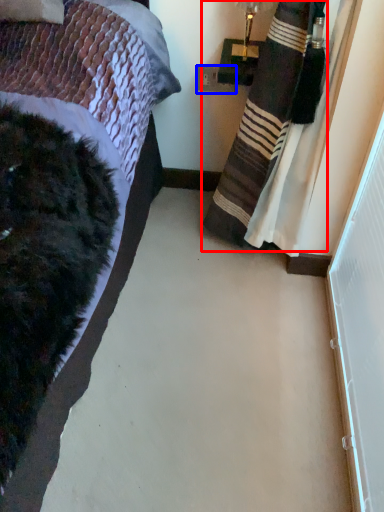
Question: Which object appears closest to the camera in this image, curtain (highlighted by a red box) or power outlet (highlighted by a blue box)?

Choices:
 (A) curtain
 (B) power outlet

Answer: (A)